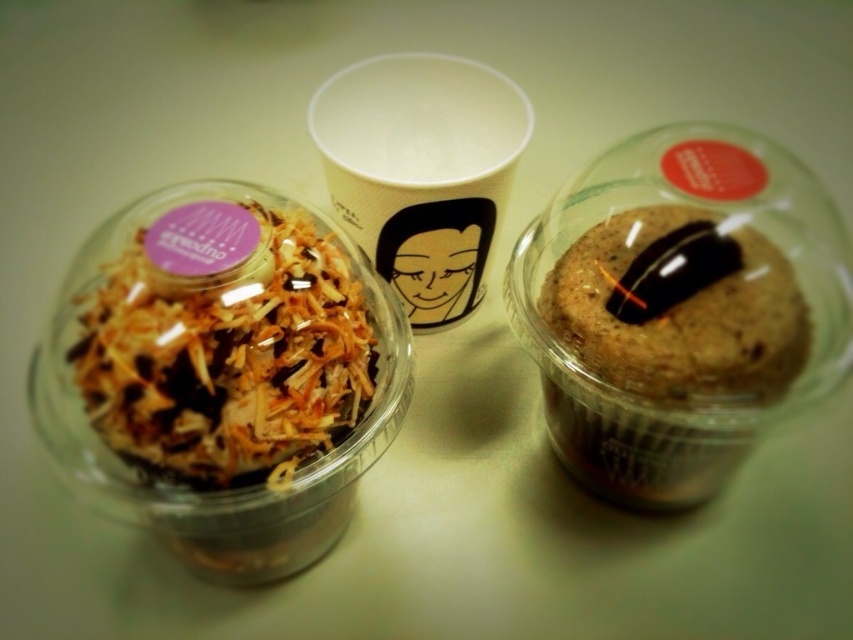
Is point (296, 227) less distant than point (418, 188)?

Yes, point (296, 227) is in front of point (418, 188).

Is translucent plastic dessert at left to the left of white paper cup at center from the viewer's perspective?

Indeed, translucent plastic dessert at left is positioned on the left side of white paper cup at center.

Locate an element on the screen. Image resolution: width=853 pixels, height=640 pixels. translucent plastic dessert at left is located at coordinates (225, 353).

Find the location of `translucent plastic dessert at left`. translucent plastic dessert at left is located at coordinates (225, 353).

Between brown matte muffin at right and white paper cup at center, which one appears on the left side from the viewer's perspective?

white paper cup at center is more to the left.

Does brown matte muffin at right have a smaller size compared to white paper cup at center?

Correct, brown matte muffin at right occupies less space than white paper cup at center.

Is point (669, 220) farther from viewer compared to point (322, 108)?

No.

I want to click on brown matte muffin at right, so click(665, 358).

Which is above, translucent plastic dessert at left or brown matte muffin at right?

Positioned higher is translucent plastic dessert at left.

Is translucent plastic dessert at left positioned before brown matte muffin at right?

Yes, translucent plastic dessert at left is closer to the viewer.

Between point (157, 369) and point (650, 358), which one is positioned behind?

The point (650, 358) is more distant.

I want to click on translucent plastic dessert at left, so click(x=225, y=353).